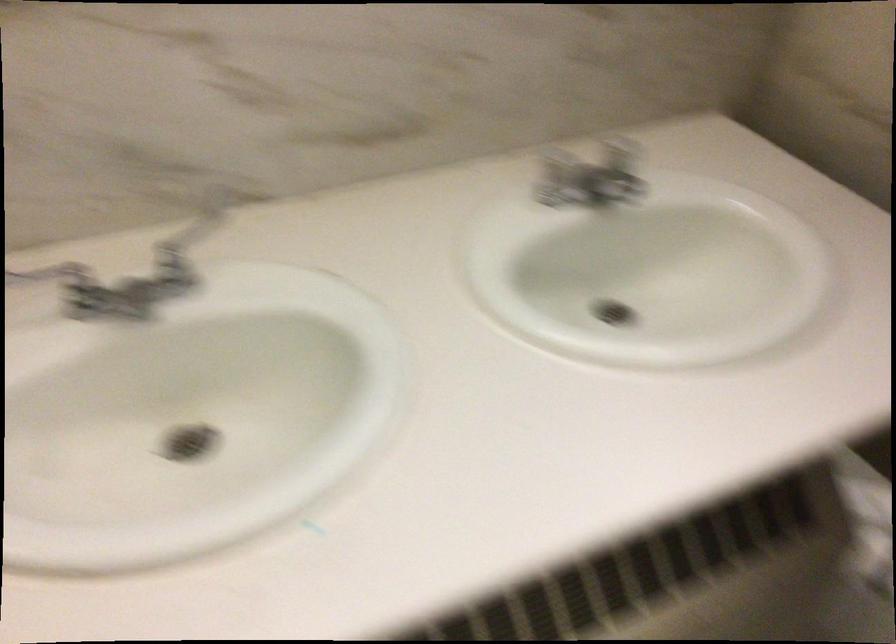
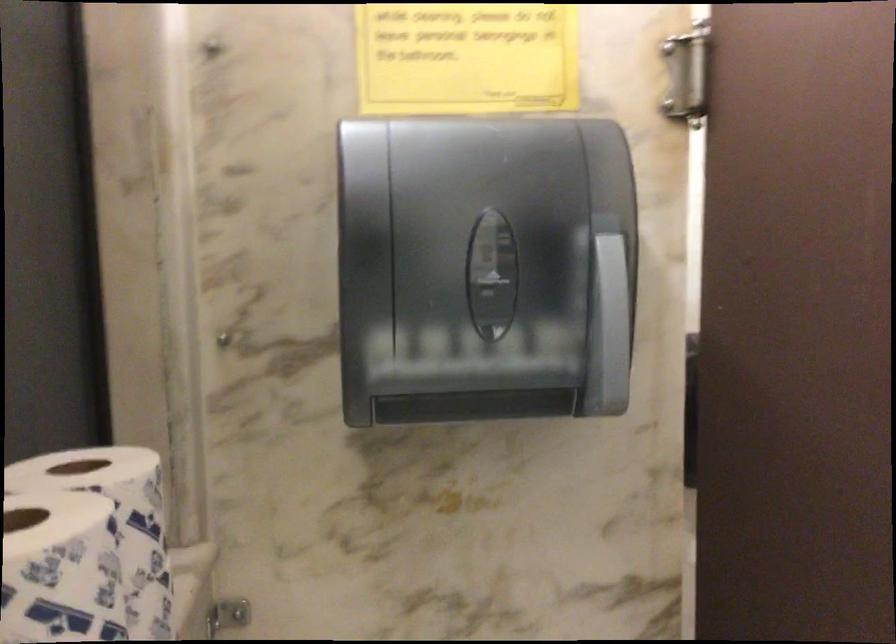
Question: The camera is either moving clockwise (left) or counter-clockwise (right) around the object. The first image is from the beginning of the video and the second image is from the end. Is the camera moving left or right when shooting the video?

Choices:
 (A) Left
 (B) Right

Answer: (A)